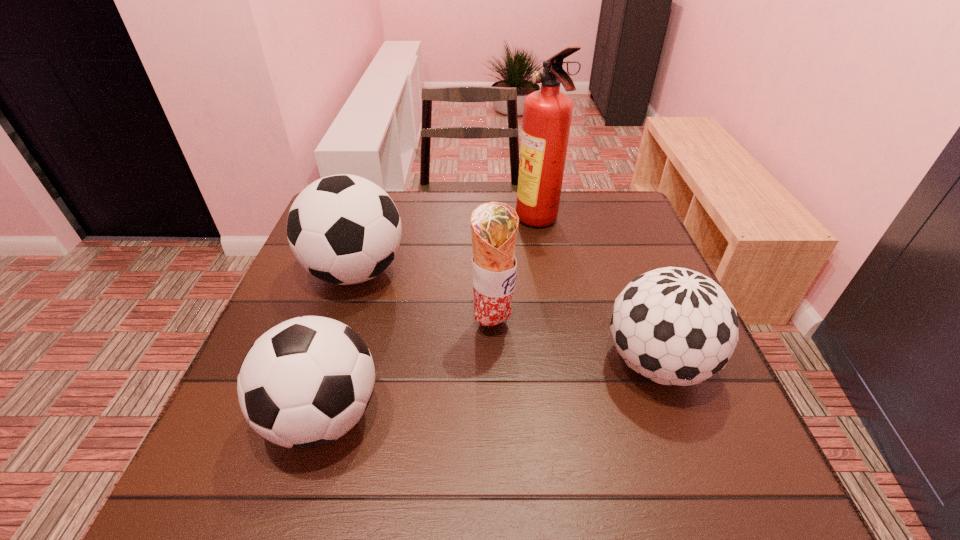
Locate which soccer ball ranks second in proximity to the burrito. Please provide its 2D coordinates. Your answer should be formatted as a tuple, i.e. [(x, y)], where the tuple contains the x and y coordinates of a point satisfying the conditions above.

[(306, 382)]

You are a GUI agent. You are given a task and a screenshot of the screen. Output one action in this format:
    pyautogui.click(x=<x>, y=<y>)
    Task: Click on the free space that satisfies the following two spatial constraints: 1. on the front side of the farthest soccer ball; 2. on the right side of the burrito
    The image size is (960, 540).
    Given the screenshot: What is the action you would take?
    pyautogui.click(x=339, y=325)

Where is `free point that satisfies the following two spatial constraints: 1. on the back side of the rightmost soccer ball; 2. on the front-facing side of the fire extinguisher`? The height and width of the screenshot is (540, 960). free point that satisfies the following two spatial constraints: 1. on the back side of the rightmost soccer ball; 2. on the front-facing side of the fire extinguisher is located at coordinates (604, 222).

I want to click on free location that satisfies the following two spatial constraints: 1. on the front-facing side of the tallest object; 2. on the front side of the farthest soccer ball, so click(547, 272).

At what (x,y) coordinates should I click in order to perform the action: click on free space that satisfies the following two spatial constraints: 1. on the front-facing side of the second object from right to left; 2. on the back side of the rightmost soccer ball. Please return your answer as a coordinate pair (x, y). Looking at the image, I should click on (564, 363).

Identify the location of vacant position in the image that satisfies the following two spatial constraints: 1. on the front-facing side of the rightmost soccer ball; 2. on the left side of the farthest object. (564, 363).

Identify the location of vacant space that satisfies the following two spatial constraints: 1. on the front-facing side of the rightmost object; 2. on the right side of the farthest object. pyautogui.click(x=564, y=363).